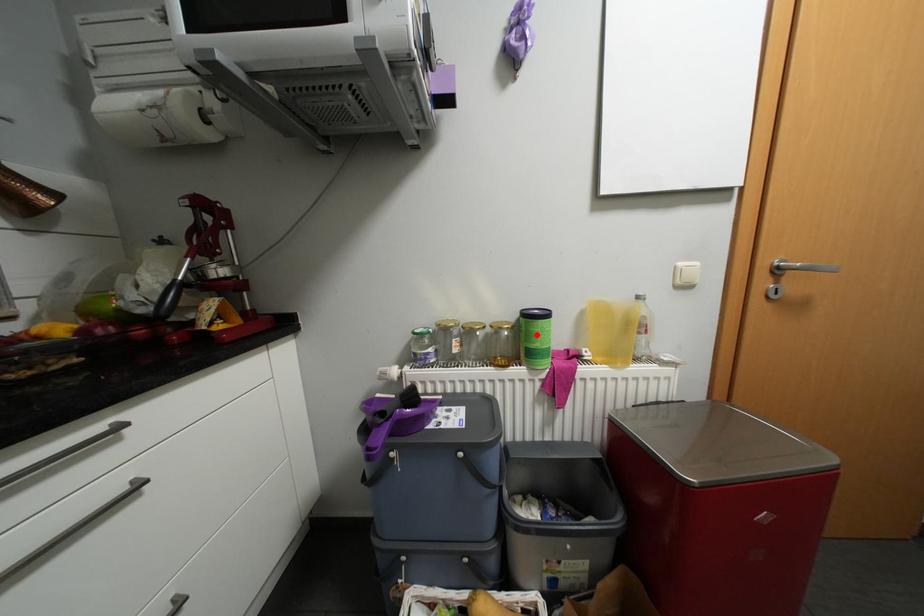
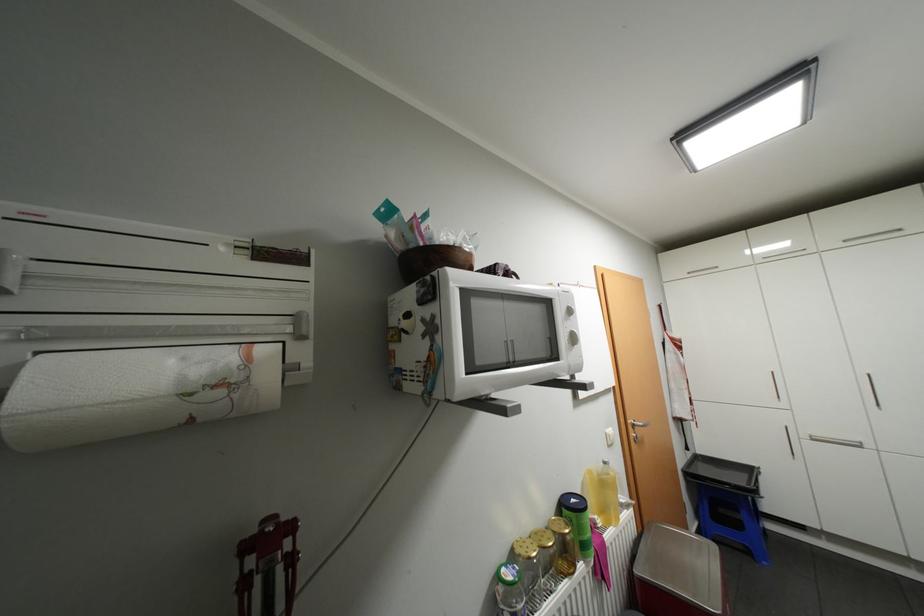
In the second image, find the point that corresponds to the highlighted location in the first image.

(589, 528)